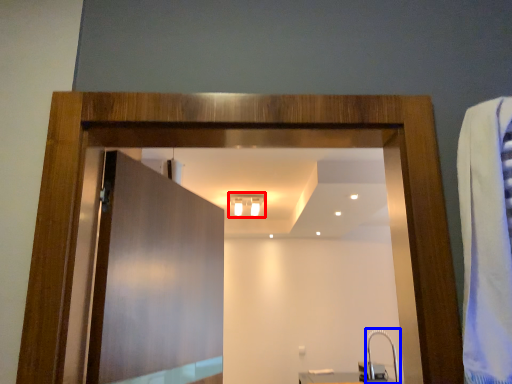
Question: Which object appears farthest to the camera in this image, light fixture (highlighted by a red box) or faucet (highlighted by a blue box)?

Choices:
 (A) light fixture
 (B) faucet

Answer: (A)